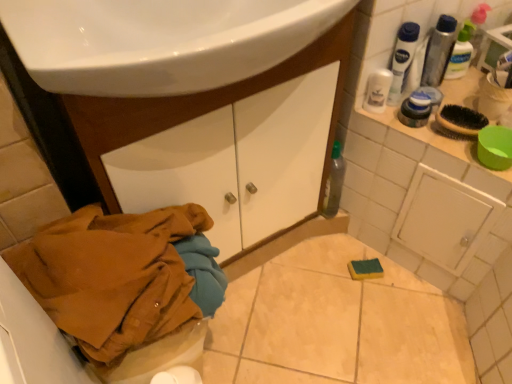
Locate an element on the screen. Image resolution: width=512 pixels, height=384 pixels. free spot to the right of white plastic mouthwash at upper right, which is the 2th mouthwash from left to right is located at coordinates (459, 102).